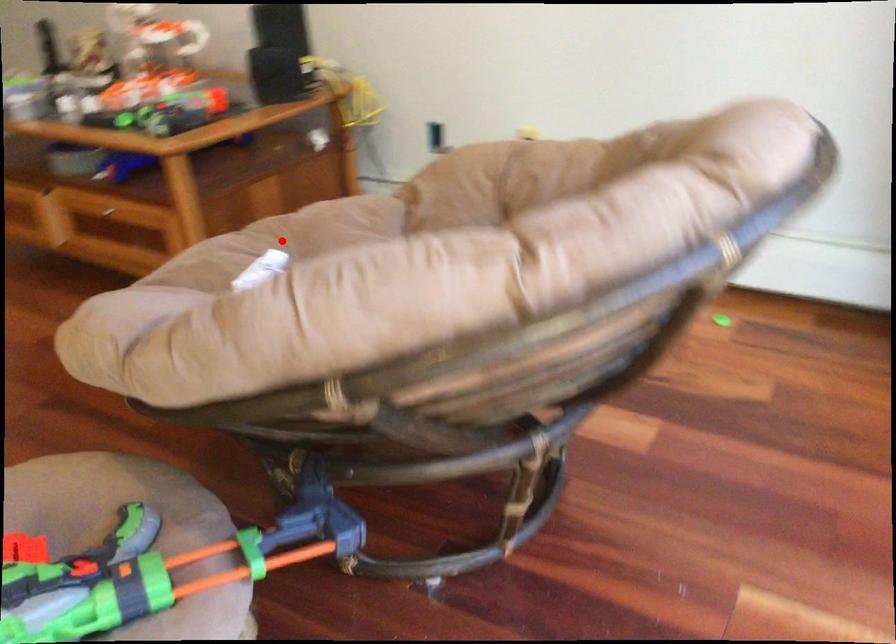
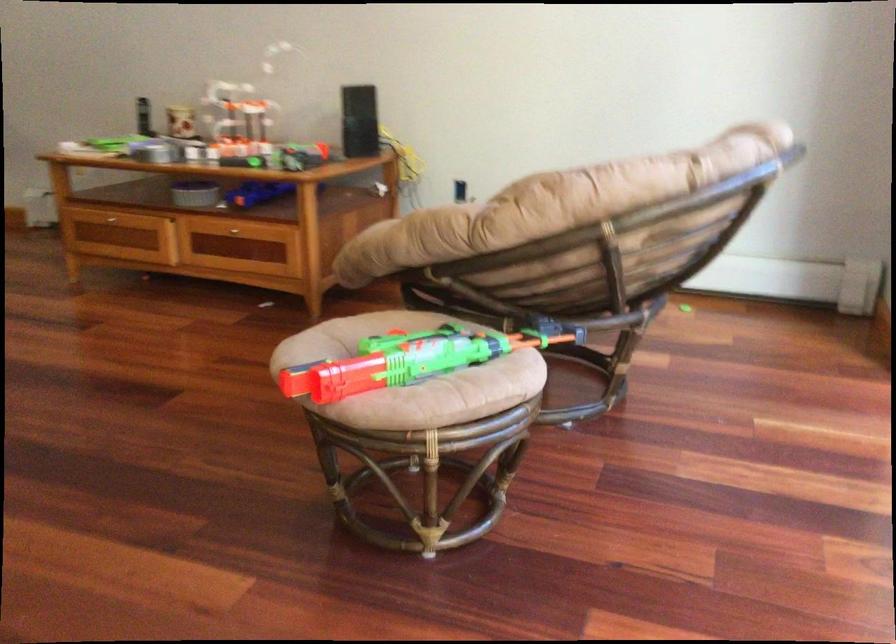
Question: I am providing you with two images of the same scene from different viewpoints. A red point is marked on the first image. At the location where the point appears in image 1, is it still visible in image 2?

Choices:
 (A) Yes
 (B) No

Answer: (B)